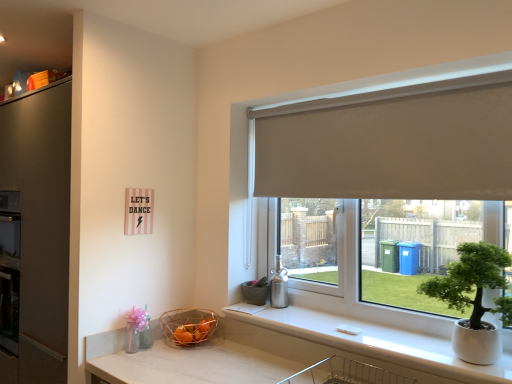
Question: In terms of size, does white fabric roller blind at upper center appear bigger or smaller than copper wire basket at lower center?

Choices:
 (A) big
 (B) small

Answer: (A)

Question: Is white fabric roller blind at upper center taller or shorter than copper wire basket at lower center?

Choices:
 (A) short
 (B) tall

Answer: (B)

Question: Which object is the farthest from the white fabric roller blind at upper center?

Choices:
 (A) white glossy counter top at lower right
 (B) green matte houseplant at right
 (C) matte gray flowerpot at window
 (D) copper wire basket at lower center

Answer: (D)

Question: Which object is positioned closest to the white glossy counter top at lower right?

Choices:
 (A) green matte houseplant at right
 (B) copper wire basket at lower center
 (C) white fabric roller blind at upper center
 (D) matte gray flowerpot at window

Answer: (A)